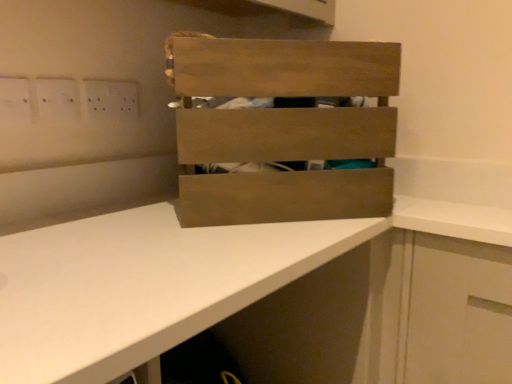
Question: Is point (x=282, y=233) positioned closer to the camera than point (x=97, y=92)?

Choices:
 (A) farther
 (B) closer

Answer: (B)

Question: Would you say white matte countertop at center is inside or outside white plastic electric outlet at upper left?

Choices:
 (A) outside
 (B) inside

Answer: (A)

Question: Considering the real-world distances, which object is farthest from the white plastic electric outlet at upper left?

Choices:
 (A) white matte countertop at center
 (B) wooden crate at center

Answer: (A)

Question: Which of these objects is positioned closest to the white plastic electric outlet at upper left?

Choices:
 (A) wooden crate at center
 (B) white matte countertop at center

Answer: (A)